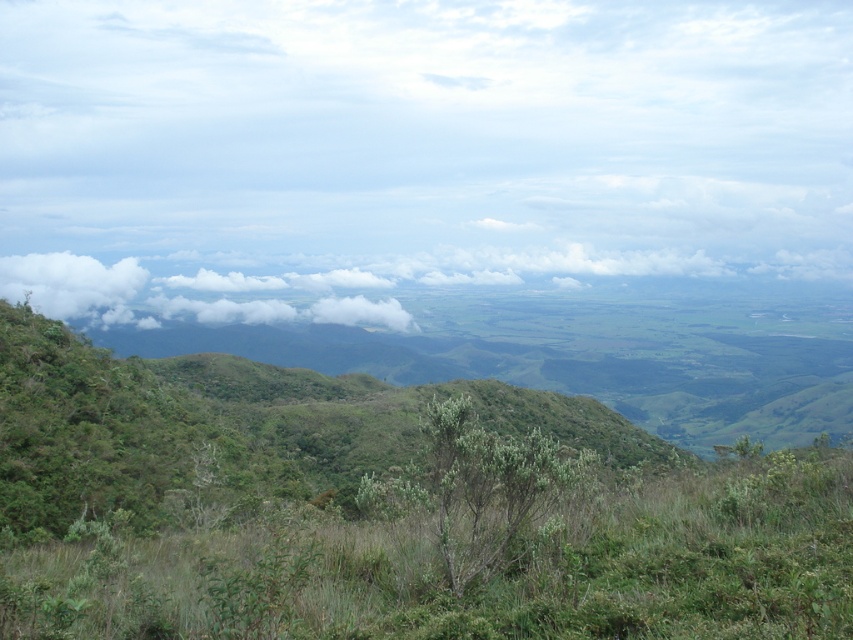
You are an airplane pilot flying over the landscape. You notice two white fluffy clouds in the sky. Which one is higher in the sky between the white fluffy cloud at upper center and the white fluffy cloud at center?

The white fluffy cloud at upper center is higher in the sky than the white fluffy cloud at center because it is positioned above it.

In the scene shown: You are a bird soaring high above the landscape. You spot the green leafy bush at center and the white fluffy cloud at center. Which object is closer to the ground?

The green leafy bush at center is closer to the ground than the white fluffy cloud at center because it is not as tall as the cloud.